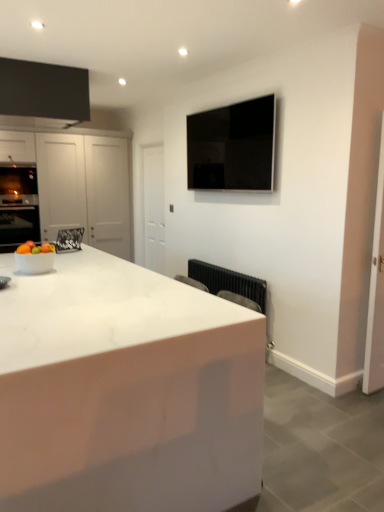
Question: Is white marble countertop at center positioned before black glossy tv at upper center?

Choices:
 (A) no
 (B) yes

Answer: (B)

Question: Is white marble countertop at center positioned with its back to black glossy tv at upper center?

Choices:
 (A) yes
 (B) no

Answer: (B)

Question: Considering the relative sizes of white marble countertop at center and black glossy tv at upper center in the image provided, is white marble countertop at center thinner than black glossy tv at upper center?

Choices:
 (A) yes
 (B) no

Answer: (B)

Question: Does white marble countertop at center have a greater width compared to black glossy tv at upper center?

Choices:
 (A) yes
 (B) no

Answer: (A)

Question: Is white marble countertop at center far away from black glossy tv at upper center?

Choices:
 (A) no
 (B) yes

Answer: (B)

Question: Based on their sizes in the image, would you say black metallic radiator at lower center is bigger or smaller than shiny white bowl at left?

Choices:
 (A) small
 (B) big

Answer: (B)

Question: Is black metallic radiator at lower center to the left or to the right of shiny white bowl at left in the image?

Choices:
 (A) right
 (B) left

Answer: (A)

Question: In terms of width, does black metallic radiator at lower center look wider or thinner when compared to shiny white bowl at left?

Choices:
 (A) wide
 (B) thin

Answer: (B)

Question: From the image's perspective, relative to shiny white bowl at left, is black metallic radiator at lower center above or below?

Choices:
 (A) above
 (B) below

Answer: (B)

Question: From the image's perspective, is white marble countertop at center above or below white glossy bowl at lower left?

Choices:
 (A) above
 (B) below

Answer: (B)

Question: From a real-world perspective, is white marble countertop at center positioned above or below white glossy bowl at lower left?

Choices:
 (A) below
 (B) above

Answer: (A)

Question: From their relative heights in the image, would you say white marble countertop at center is taller or shorter than white glossy bowl at lower left?

Choices:
 (A) tall
 (B) short

Answer: (A)

Question: In terms of width, does white marble countertop at center look wider or thinner when compared to white glossy bowl at lower left?

Choices:
 (A) thin
 (B) wide

Answer: (B)

Question: Is black metallic radiator at lower center wider or thinner than white glossy cabinet at left?

Choices:
 (A) wide
 (B) thin

Answer: (B)

Question: Do you think black metallic radiator at lower center is within white glossy cabinet at left, or outside of it?

Choices:
 (A) outside
 (B) inside

Answer: (A)